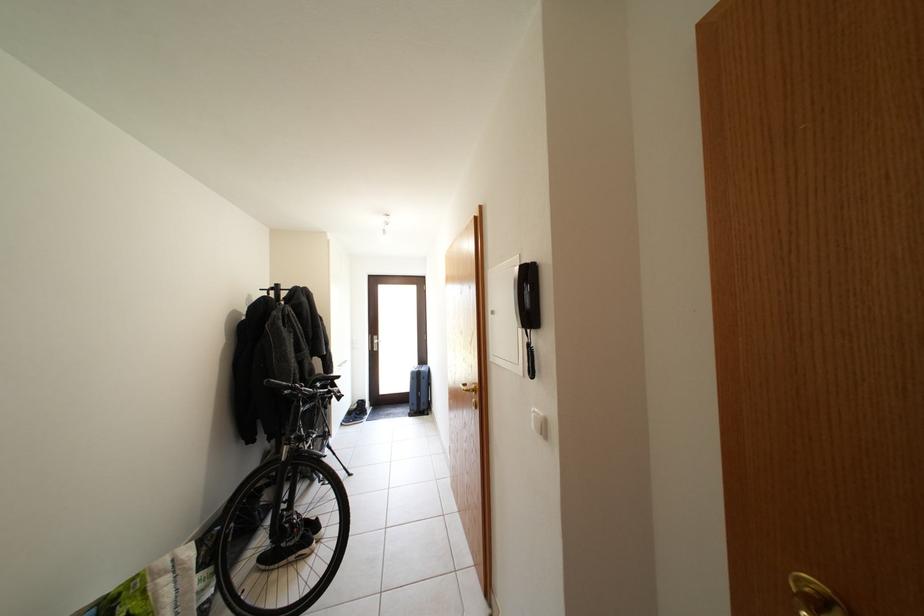
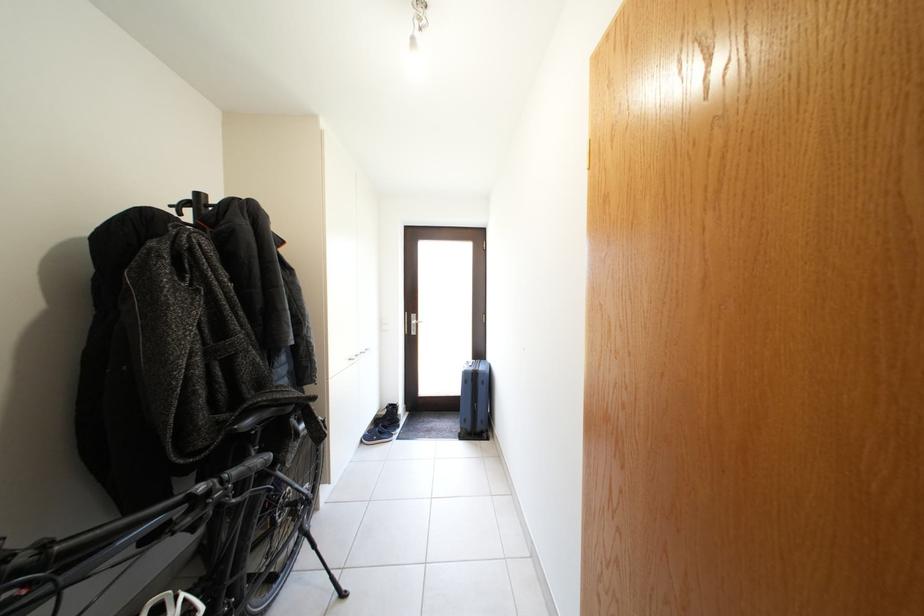
Find the pixel in the second image that matches point (383, 342) in the first image.

(421, 322)